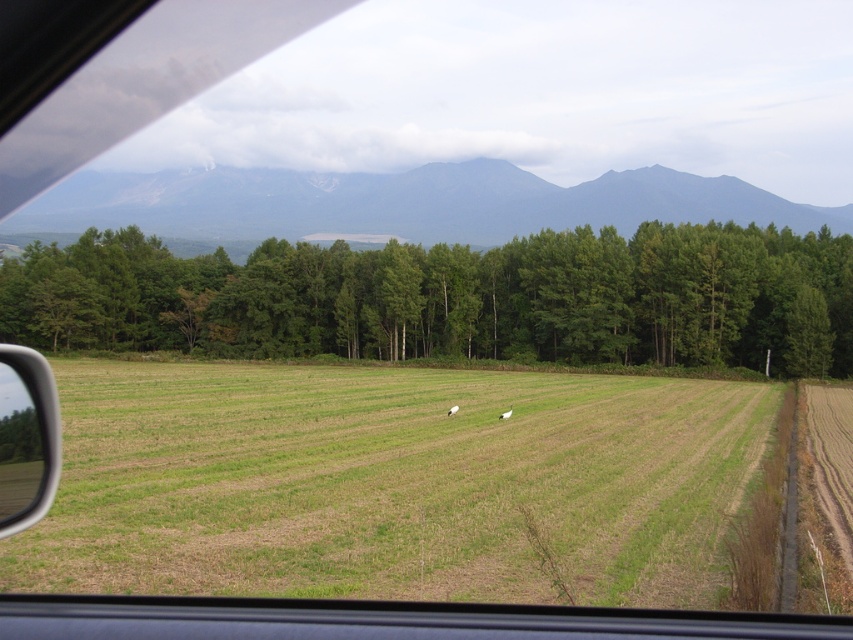
Does grayish-blue mountain at upper center appear on the right side of white woolen sheep at center?

Incorrect, grayish-blue mountain at upper center is not on the right side of white woolen sheep at center.

Who is shorter, grayish-blue mountain at upper center or white woolen sheep at center?

white woolen sheep at center is shorter.

Image resolution: width=853 pixels, height=640 pixels. What are the coordinates of `grayish-blue mountain at upper center` in the screenshot? It's located at (402, 204).

I want to click on grayish-blue mountain at upper center, so click(402, 204).

Consider the image. Does green grass at center appear on the right side of white woolen sheep at center?

Indeed, green grass at center is positioned on the right side of white woolen sheep at center.

Can you confirm if green grass at center is wider than white woolen sheep at center?

Yes, green grass at center is wider than white woolen sheep at center.

Who is more distant from viewer, [347,442] or [451,406]?

Point [451,406]

You are a GUI agent. You are given a task and a screenshot of the screen. Output one action in this format:
    pyautogui.click(x=<x>, y=<y>)
    Task: Click on the green grass at center
    
    Given the screenshot: What is the action you would take?
    pyautogui.click(x=390, y=483)

Is matte plastic side mirror at lower left wider than white woolen sheep at center?

Yes, matte plastic side mirror at lower left is wider than white woolen sheep at center.

The height and width of the screenshot is (640, 853). Describe the element at coordinates (26, 436) in the screenshot. I see `matte plastic side mirror at lower left` at that location.

Image resolution: width=853 pixels, height=640 pixels. Identify the location of matte plastic side mirror at lower left. (26, 436).